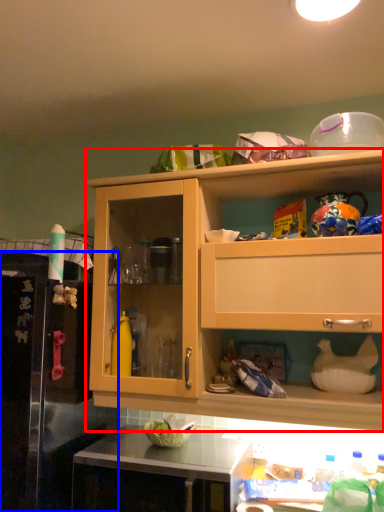
Question: Which object appears farthest to the camera in this image, cabinetry (highlighted by a red box) or leftover (highlighted by a blue box)?

Choices:
 (A) cabinetry
 (B) leftover

Answer: (A)